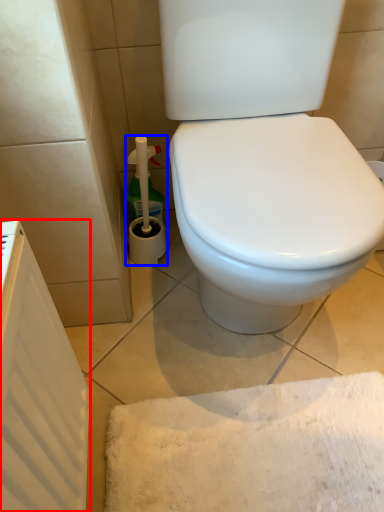
Question: Which point is further to the camera, radiator (highlighted by a red box) or cleaning product (highlighted by a blue box)?

Choices:
 (A) radiator
 (B) cleaning product

Answer: (B)